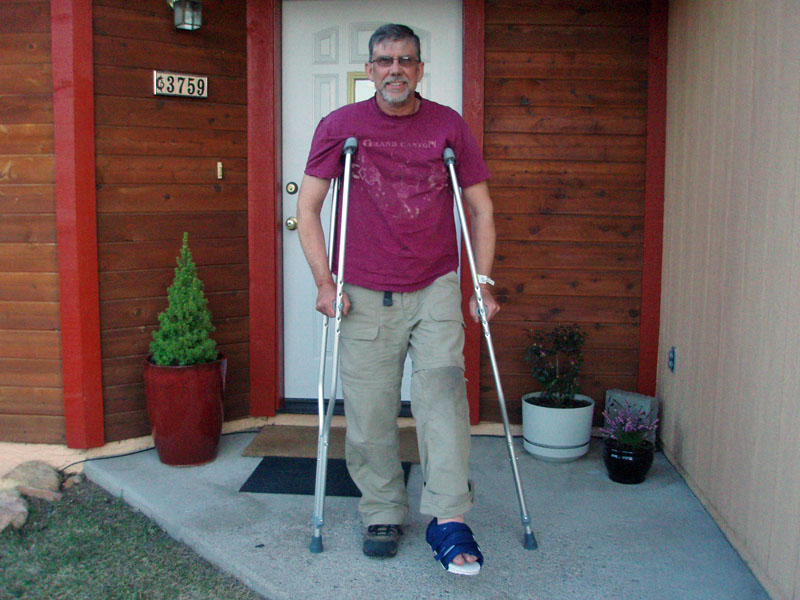
This screenshot has width=800, height=600. Find the location of `plant`. plant is located at coordinates (186, 363).